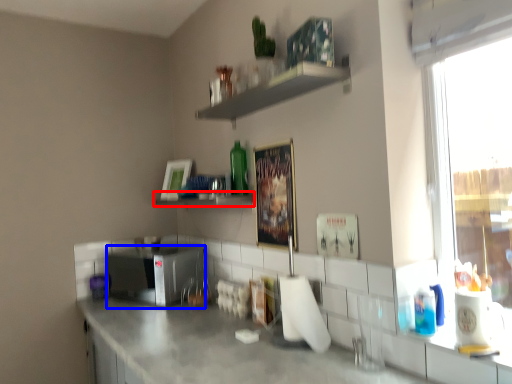
Question: Among these objects, which one is farthest to the camera, shelf (highlighted by a red box) or appliance (highlighted by a blue box)?

Choices:
 (A) shelf
 (B) appliance

Answer: (B)